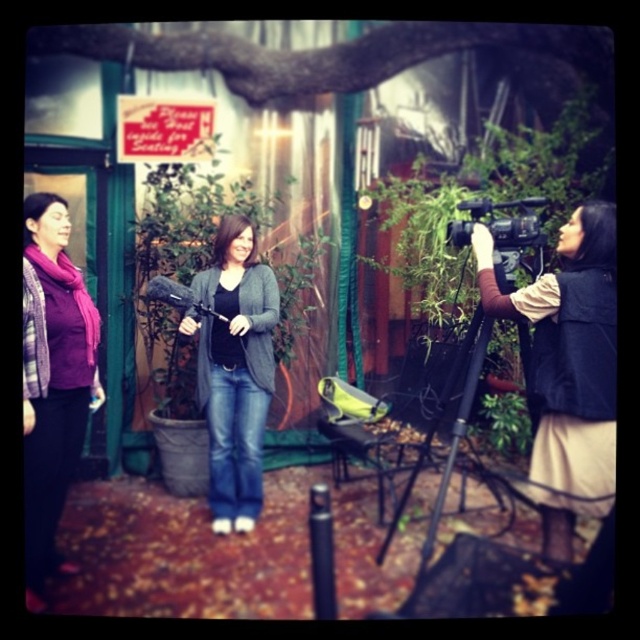
Is matte gray cardigan at center closer to camera compared to black plastic video camera at center?

That is False.

Does point (224, 419) lie behind point (532, 225)?

Yes, point (224, 419) is behind point (532, 225).

At what (x,y) coordinates should I click in order to perform the action: click on matte gray cardigan at center. Please return your answer as a coordinate pair (x, y). This screenshot has width=640, height=640. Looking at the image, I should click on (234, 371).

Does black plastic video camera at center have a greater width compared to matte black microphone at center?

In fact, black plastic video camera at center might be narrower than matte black microphone at center.

Is black plastic video camera at center bigger than matte black microphone at center?

Correct, black plastic video camera at center is larger in size than matte black microphone at center.

Locate an element on the screen. black plastic video camera at center is located at coordinates (500, 224).

Who is lower down, matte purple scarf at left or black metal tripod at center?

black metal tripod at center is lower down.

Locate an element on the screen. matte purple scarf at left is located at coordinates tap(52, 381).

Locate an element on the screen. The image size is (640, 640). matte purple scarf at left is located at coordinates (52, 381).